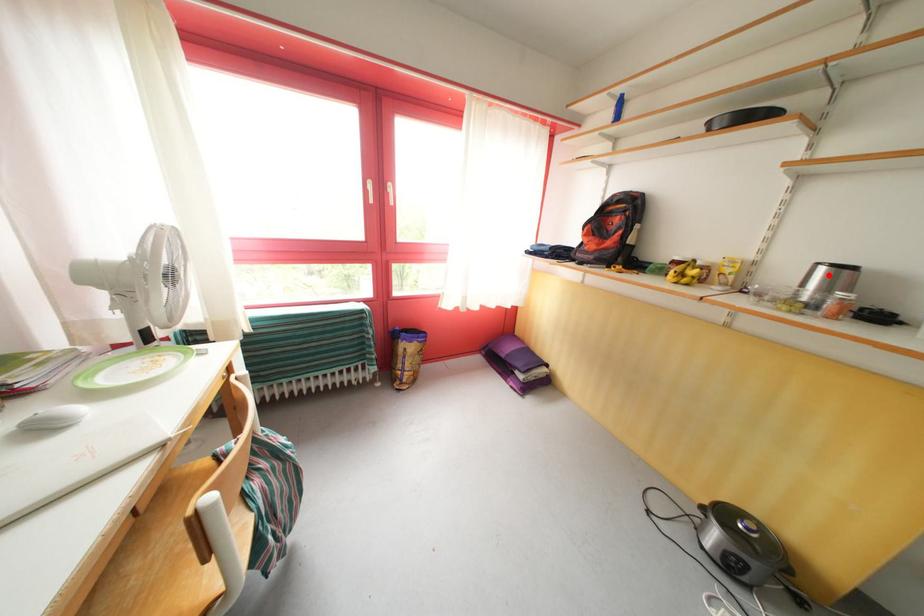
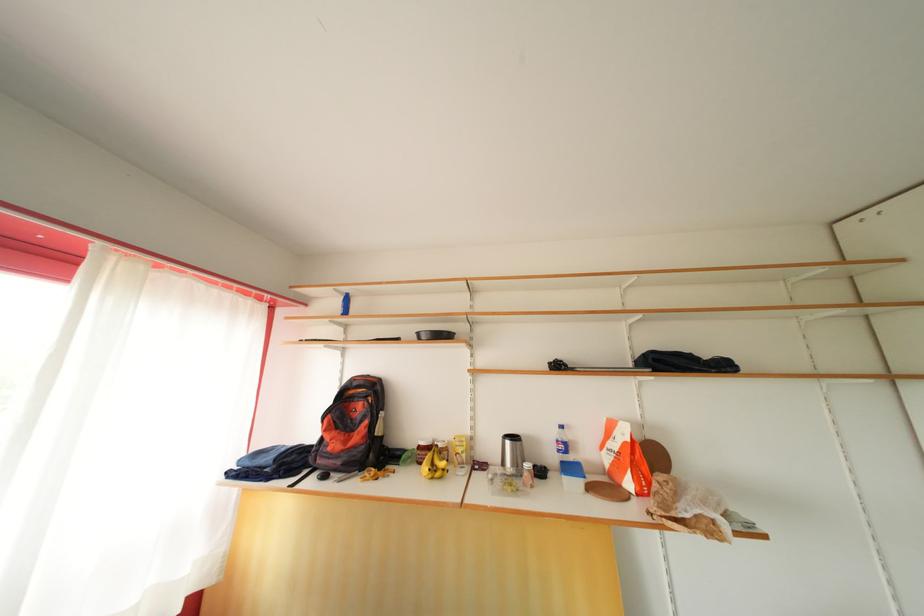
Locate, in the second image, the point that corresponds to the highlighted location in the first image.

(515, 448)